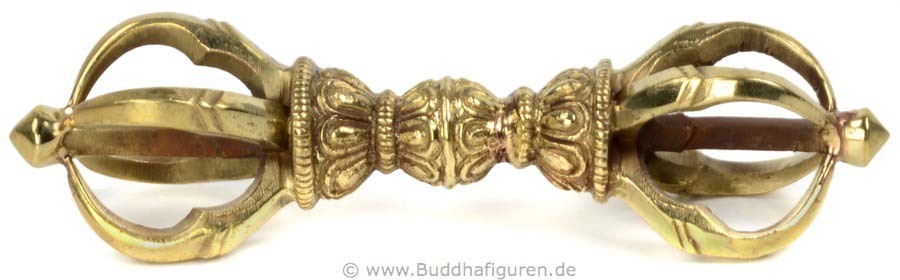
This screenshot has width=900, height=280. I want to click on scuff marks, so click(x=228, y=43).